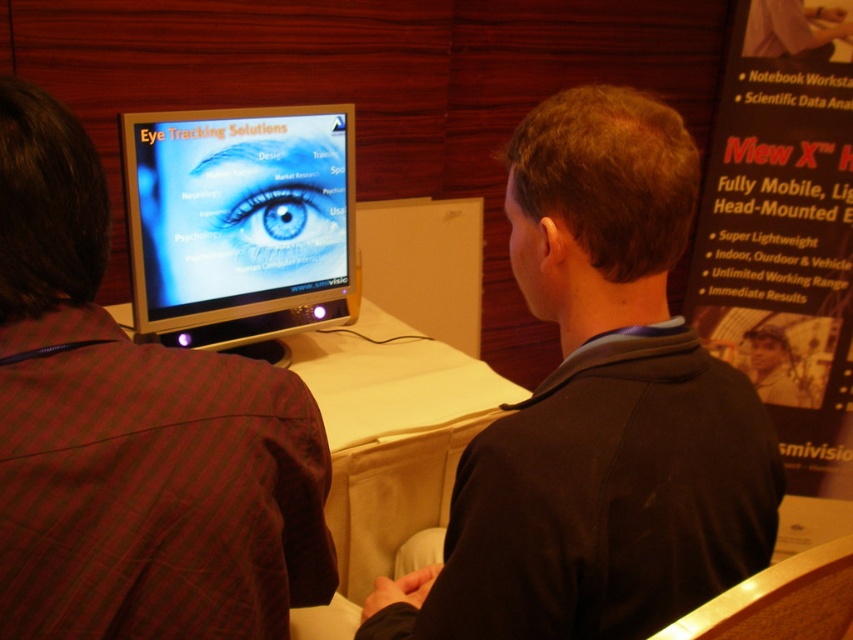
Can you confirm if satin black monitor at center is shorter than white fabric table at center?

Indeed, satin black monitor at center has a lesser height compared to white fabric table at center.

Which is above, satin black monitor at center or white fabric table at center?

satin black monitor at center is above.

Which is in front, point (129, 180) or point (410, 342)?

Positioned in front is point (129, 180).

The width and height of the screenshot is (853, 640). In order to click on satin black monitor at center in this screenshot , I will do `click(239, 221)`.

Does black matte jacket at center have a larger size compared to blue glossy eye at center?

Correct, black matte jacket at center is larger in size than blue glossy eye at center.

Who is positioned more to the right, black matte jacket at center or blue glossy eye at center?

black matte jacket at center

At what (x,y) coordinates should I click in order to perform the action: click on black matte jacket at center. Please return your answer as a coordinate pair (x, y). The image size is (853, 640). Looking at the image, I should click on (599, 410).

The image size is (853, 640). I want to click on black matte jacket at center, so click(x=599, y=410).

Consider the image. Does satin black monitor at center have a larger size compared to blue glossy eye at center?

Yes.

Is satin black monitor at center wider than blue glossy eye at center?

Yes.

Which is in front, point (134, 253) or point (279, 212)?

Positioned in front is point (134, 253).

This screenshot has height=640, width=853. I want to click on satin black monitor at center, so click(x=239, y=221).